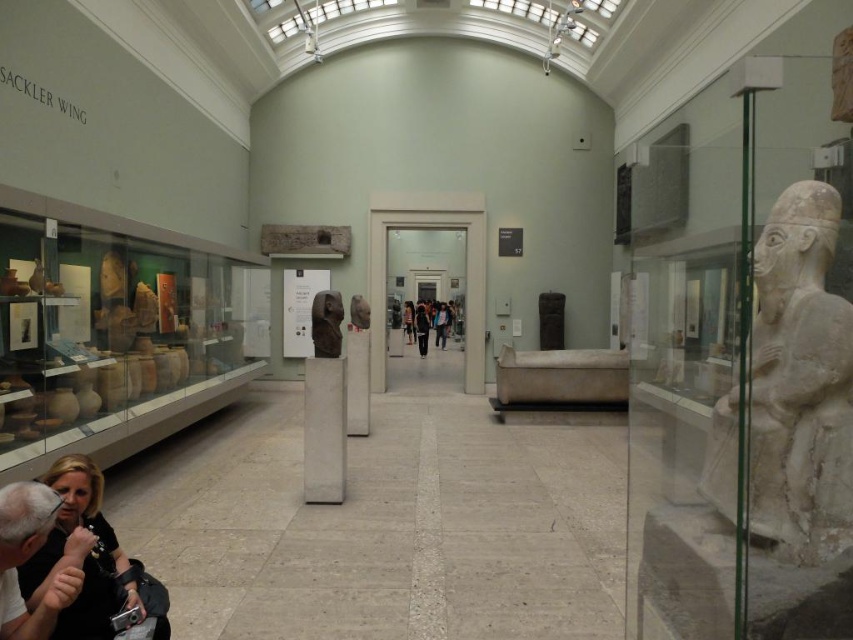
From the picture: Is white marble pillar at center further to the viewer compared to matte stone bust at center?

No, white marble pillar at center is in front of matte stone bust at center.

Does white marble pillar at center have a greater height compared to matte stone bust at center?

Yes.

Locate an element on the screen. This screenshot has height=640, width=853. white marble pillar at center is located at coordinates click(x=323, y=429).

Does white textured shirt at lower left have a larger size compared to matte stone bust at center?

No.

Between white textured shirt at lower left and matte stone bust at center, which one appears on the left side from the viewer's perspective?

→ white textured shirt at lower left is more to the left.

The image size is (853, 640). Describe the element at coordinates (27, 557) in the screenshot. I see `white textured shirt at lower left` at that location.

In order to click on white textured shirt at lower left in this screenshot , I will do `click(27, 557)`.

Between matte black hair at lower left and white textured shirt at lower left, which one appears on the right side from the viewer's perspective?

matte black hair at lower left is more to the right.

Who is more forward, [132,573] or [33,509]?

Point [33,509]

Find the location of a particular element. matte black hair at lower left is located at coordinates (82, 556).